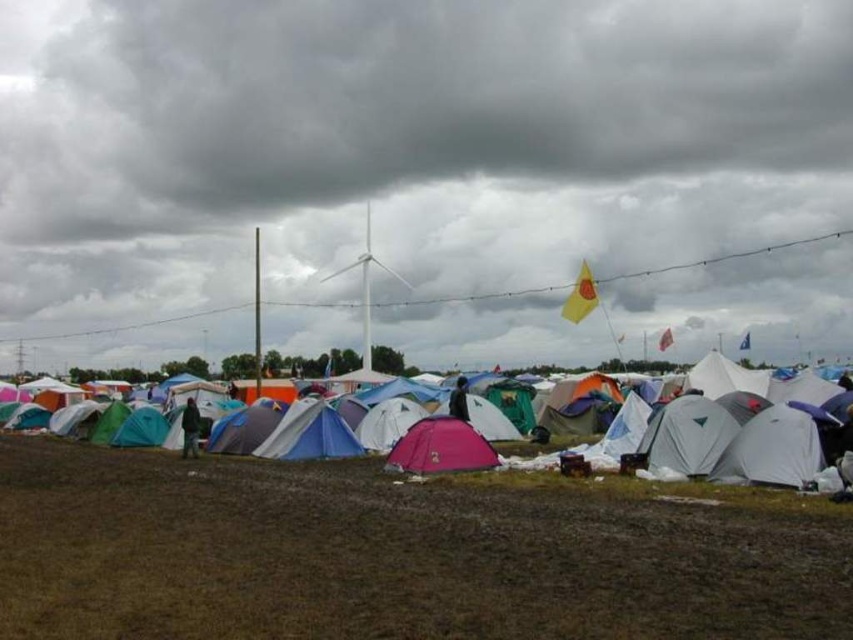
Is multicolored fabric tents at center closer to camera compared to pink fabric tent at center?

Yes, multicolored fabric tents at center is closer to the viewer.

Can you confirm if multicolored fabric tents at center is taller than pink fabric tent at center?

Correct, multicolored fabric tents at center is much taller as pink fabric tent at center.

Is point (721, 419) behind point (428, 428)?

No, (721, 419) is closer to viewer.

Image resolution: width=853 pixels, height=640 pixels. In order to click on multicolored fabric tents at center in this screenshot , I will do `click(746, 436)`.

Who is more distant from viewer, (57,518) or (428,470)?

The point (428,470) is more distant.

Between brown grassy field at lower center and pink fabric tent at center, which one is positioned higher?

brown grassy field at lower center

Between point (425, 600) and point (488, 458), which one is positioned in front?

Point (425, 600)

Where is `brown grassy field at lower center`? This screenshot has height=640, width=853. brown grassy field at lower center is located at coordinates (387, 556).

Which of these two, brown grassy field at lower center or multicolored fabric tents at center, stands taller?

multicolored fabric tents at center

Does brown grassy field at lower center appear under multicolored fabric tents at center?

Yes, brown grassy field at lower center is below multicolored fabric tents at center.

Does point (26, 497) come closer to viewer compared to point (723, 408)?

That is True.

Where is `brown grassy field at lower center`? brown grassy field at lower center is located at coordinates (387, 556).